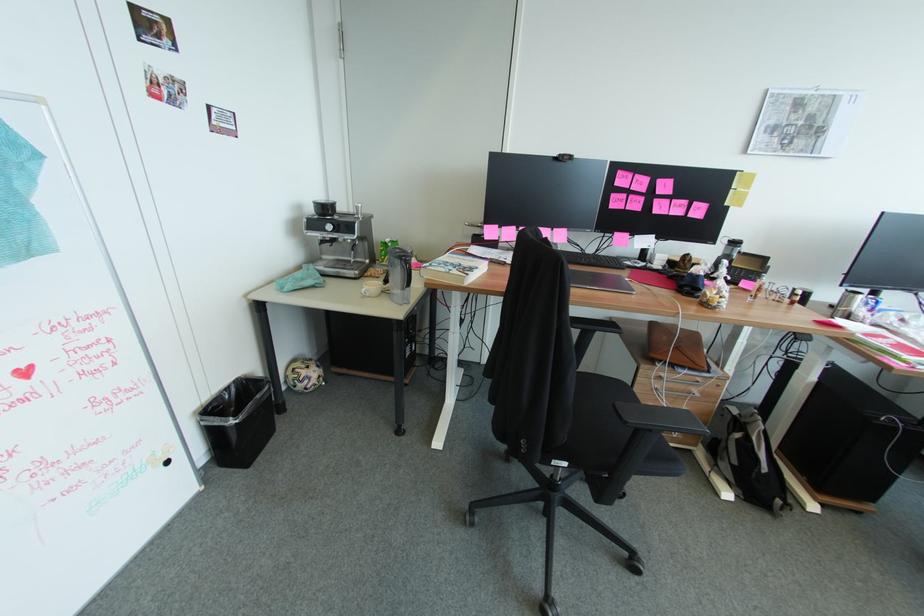
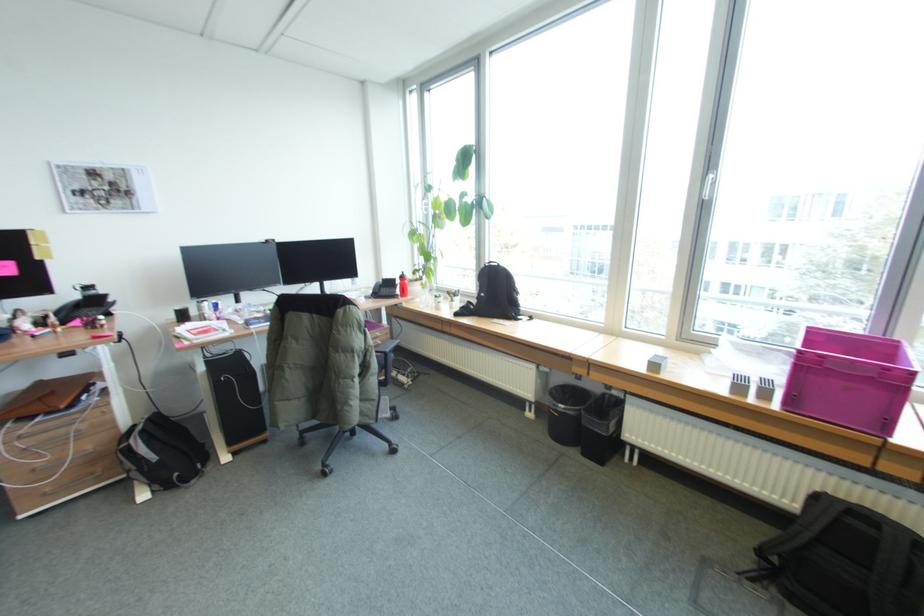
Find the pixel in the second image that matches [754,439] in the first image.

(135, 444)